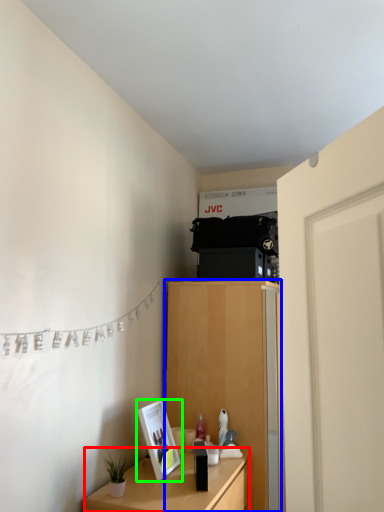
Question: Estimate the real-world distances between objects in this image. Which object is closer to table (highlighted by a red box), cabinetry (highlighted by a blue box) or picture frame (highlighted by a green box)?

Choices:
 (A) cabinetry
 (B) picture frame

Answer: (B)